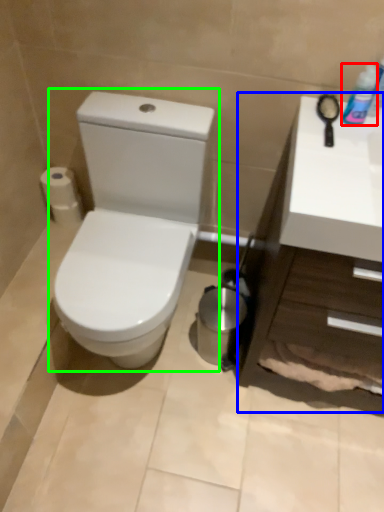
Question: Which object is positioned closest to mouthwash (highlighted by a red box)? Select from counter top (highlighted by a blue box) and toilet (highlighted by a green box).

Choices:
 (A) counter top
 (B) toilet

Answer: (A)